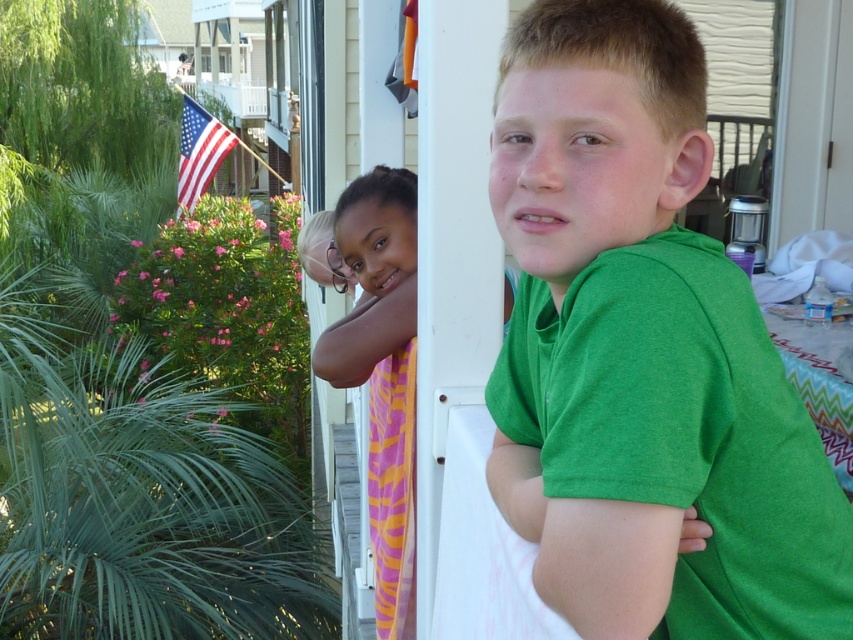
Question: Can you confirm if green cotton shirt at center is positioned below american flag at upper left?

Choices:
 (A) yes
 (B) no

Answer: (A)

Question: Which point appears closest to the camera in this image?

Choices:
 (A) (409, 189)
 (B) (607, 506)

Answer: (B)

Question: Can you confirm if matte green shirt at center is wider than american flag at upper left?

Choices:
 (A) no
 (B) yes

Answer: (A)

Question: Which point is farther to the camera?

Choices:
 (A) (415, 234)
 (B) (814, 460)
 (C) (202, 138)

Answer: (C)

Question: Which of the following is the farthest from the observer?

Choices:
 (A) matte green shirt at center
 (B) american flag at upper left

Answer: (B)

Question: Where is green cotton shirt at center located in relation to matte green shirt at center in the image?

Choices:
 (A) right
 (B) left

Answer: (A)